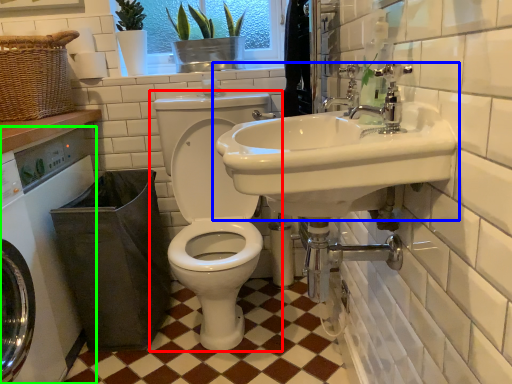
Question: Based on their relative distances, which object is nearer to toilet (highlighted by a red box)? Choose from sink (highlighted by a blue box) and washing machine (highlighted by a green box).

Choices:
 (A) sink
 (B) washing machine

Answer: (B)